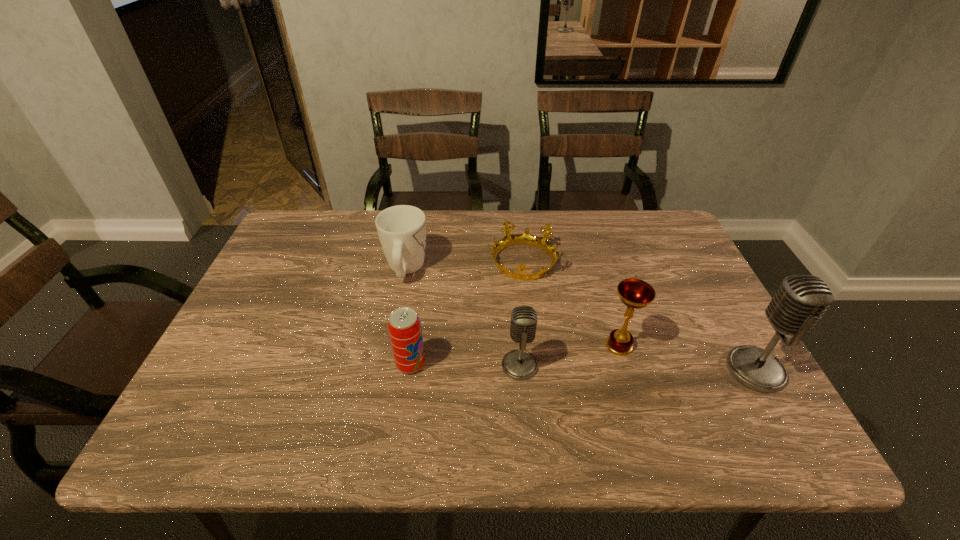
Where is `free region located on the side of the mug with the handle`? free region located on the side of the mug with the handle is located at coordinates (414, 228).

Find the location of a particular element. This screenshot has width=960, height=540. vacant area situated 0.110m on the side of the mug with the handle is located at coordinates (414, 228).

Locate an element on the screen. vacant area located on the front of the shortest object is located at coordinates (530, 331).

This screenshot has width=960, height=540. In order to click on free space located on the left of the chalice in this screenshot , I will do `click(472, 346)`.

The height and width of the screenshot is (540, 960). What are the coordinates of `free region located 0.060m on the back of the soda can` in the screenshot? It's located at (415, 333).

Identify the location of mug that is at the far edge. (401, 229).

This screenshot has height=540, width=960. What are the coordinates of `crown at the far edge` in the screenshot? It's located at (526, 238).

Identify the location of soda can located in the near edge section of the desktop. (404, 326).

Locate an element on the screen. This screenshot has height=540, width=960. object that is at the right edge is located at coordinates (800, 302).

The height and width of the screenshot is (540, 960). Find the location of `object that is at the near right corner`. object that is at the near right corner is located at coordinates (800, 302).